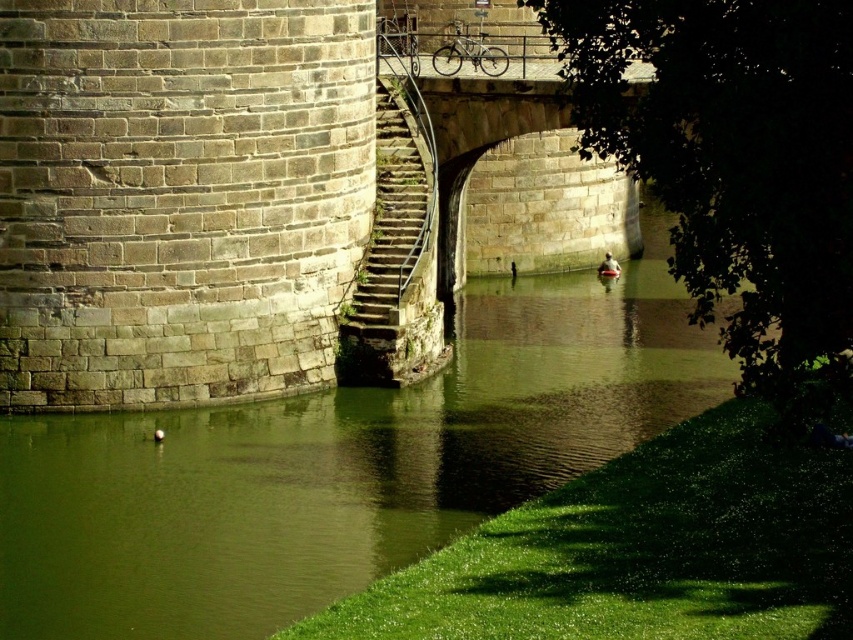
You are standing at the base of the stone bridge and want to cross to the other side. The green stone river at center and the stone textured stairs at center are both in your path. Which one takes up more space in the scene?

The green stone river at center is larger in size than the stone textured stairs at center, so the green stone river at center takes up more space in the scene.

You are standing at the point labeled as point (339, 465) in the image. What do you see around you?

You are at the green stone river at center, as indicated by the point (339, 465).